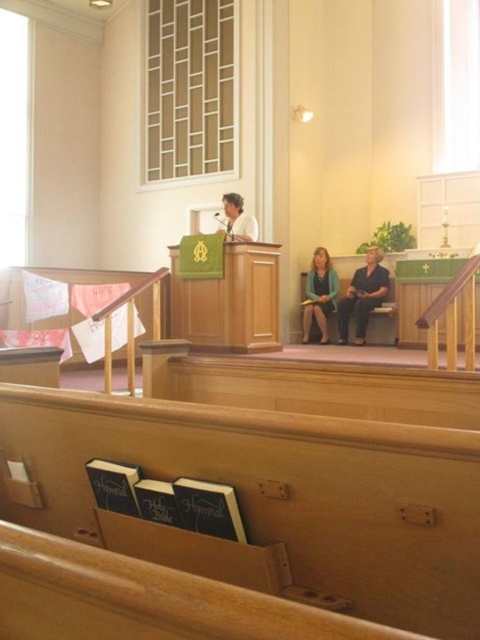
Question: Which object is positioned closest to the black fabric at center?

Choices:
 (A) green fabric jacket at center
 (B) light brown wooden podium at center

Answer: (A)

Question: Can you confirm if black fabric at center is positioned below light brown wooden podium at center?

Choices:
 (A) no
 (B) yes

Answer: (B)

Question: Is black fabric at center positioned at the back of green fabric jacket at center?

Choices:
 (A) no
 (B) yes

Answer: (A)

Question: Which object appears farthest from the camera in this image?

Choices:
 (A) light brown wooden podium at center
 (B) green fabric jacket at center
 (C) black fabric at center

Answer: (B)

Question: Based on their relative distances, which object is farther from the black fabric at center?

Choices:
 (A) light brown wooden podium at center
 (B) green fabric jacket at center

Answer: (A)

Question: Can you confirm if black fabric at center is bigger than light brown wooden podium at center?

Choices:
 (A) yes
 (B) no

Answer: (A)